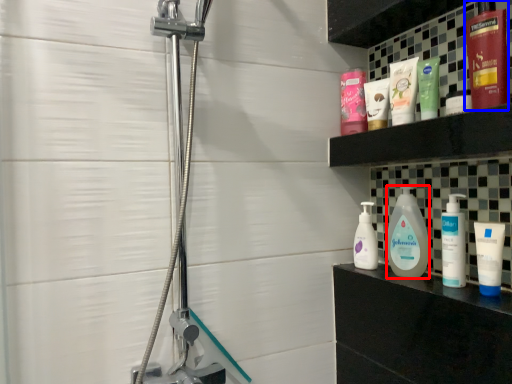
Question: Which point is further to the camera, cleaning product (highlighted by a red box) or toiletry (highlighted by a blue box)?

Choices:
 (A) cleaning product
 (B) toiletry

Answer: (A)